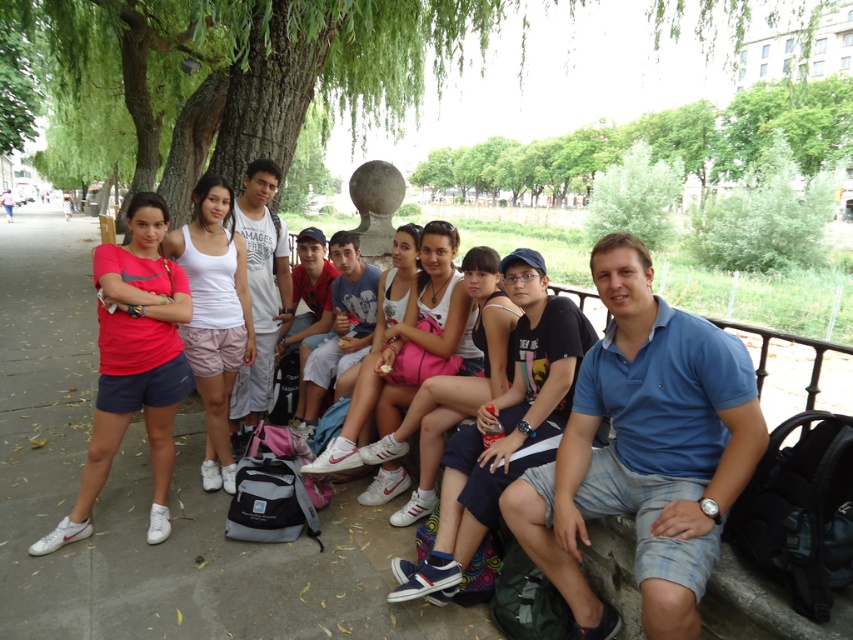
You are a photographer trying to capture a closeup of the blue cotton polo shirt at center and the white fabric tank top at center. Which one is positioned to the right side of the other?

The blue cotton polo shirt at center is to the right of the white fabric tank top at center.

You are a photographer standing at the camera position. You want to take a photo of the group while ensuring the green leafy tree at upper left is partially visible in the background. Considering the distance between the camera and the tree, can you frame the shot so that the tree is just visible behind the group without being too prominent?

The green leafy tree at upper left and camera are 13.83 feet apart. At this distance, you can frame the shot so the tree is partially visible in the background behind the group while keeping it from being too prominent.

Based on the photo, you are standing in front of the group of young people sitting on the stone bench in the park. You want to take a closer look at the two points marked in the image. Which point, point (x=33, y=10) or point (x=497, y=257), is closer to you?

Point (x=33, y=10) is closer to you because it is further to the camera than point (x=497, y=257).